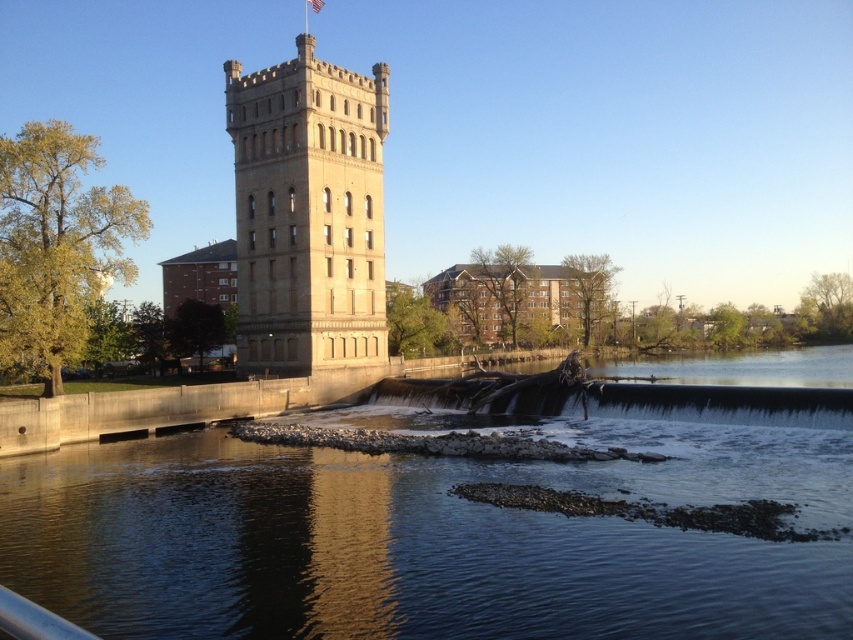
Question: Is beige stone tower at center positioned in front of metallic gray rail at lower left?

Choices:
 (A) no
 (B) yes

Answer: (A)

Question: Which object appears closest to the camera in this image?

Choices:
 (A) metallic gray rail at lower left
 (B) beige stone tower at center

Answer: (A)

Question: Which point is farther to the camera?

Choices:
 (A) (3, 598)
 (B) (368, 77)

Answer: (B)

Question: Which of the following is the farthest from the observer?

Choices:
 (A) metallic gray rail at lower left
 (B) beige stone tower at center

Answer: (B)

Question: Does beige stone tower at center come behind metallic gray rail at lower left?

Choices:
 (A) no
 (B) yes

Answer: (B)

Question: Is beige stone tower at center behind metallic gray rail at lower left?

Choices:
 (A) yes
 (B) no

Answer: (A)